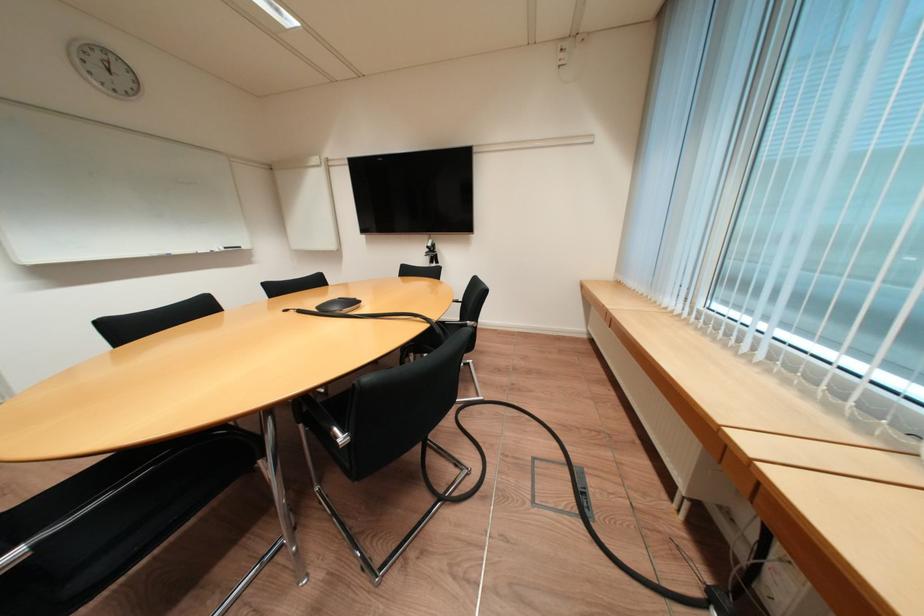
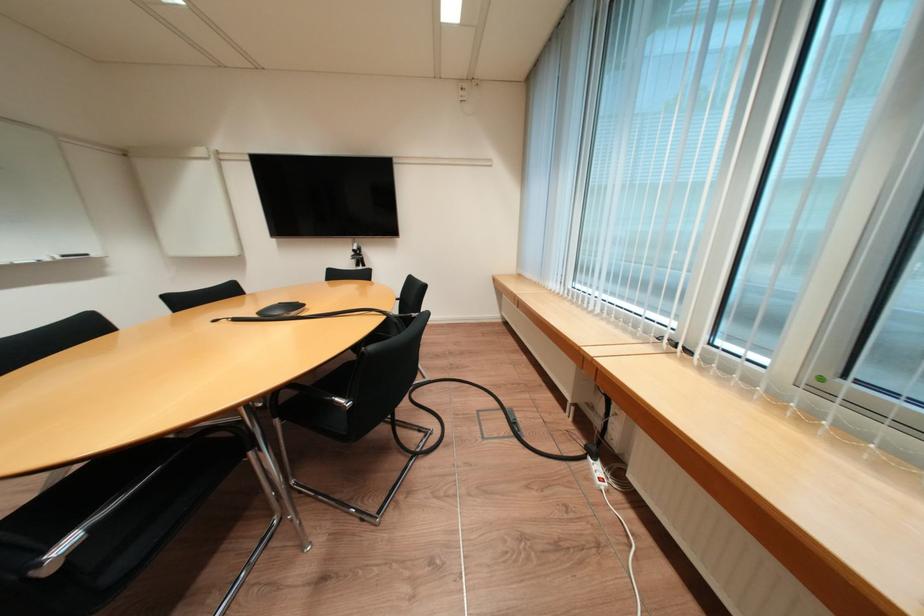
The point at (344, 430) is marked in the first image. Where is the corresponding point in the second image?

(345, 400)